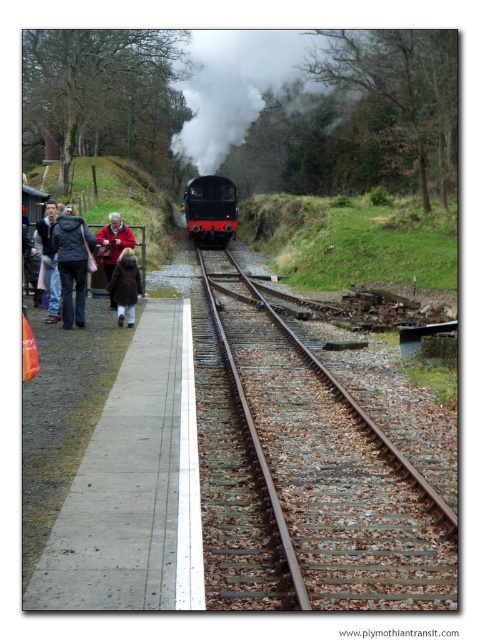
Between point (215, 58) and point (220, 204), which one is positioned in front?

Positioned in front is point (220, 204).

Between point (323, 88) and point (222, 180), which one is positioned behind?

The point (323, 88) is behind.

Locate an element on the screen. white smoke at center is located at coordinates (237, 86).

Does brown metal track at center appear on the left side of brown woolen coat at left?

No, brown metal track at center is not to the left of brown woolen coat at left.

Between point (369, 444) and point (55, 314), which one is positioned in front?

Point (369, 444) is more forward.

The width and height of the screenshot is (480, 640). Identify the location of brown metal track at center. (330, 468).

Which is more to the left, dark gray jacket at left or red woolen sweater at left?

dark gray jacket at left is more to the left.

Who is more distant from viewer, (61, 227) or (110, 260)?

Positioned behind is point (110, 260).

Find the location of a particular element. This screenshot has height=640, width=480. dark gray jacket at left is located at coordinates (72, 262).